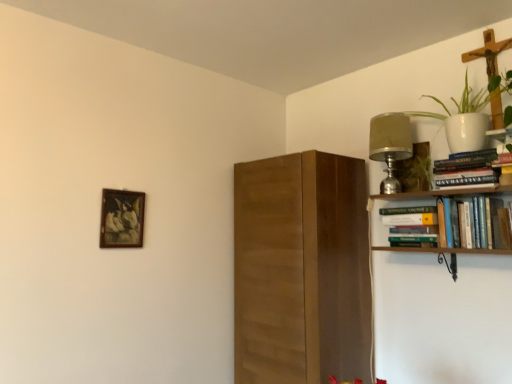
Question: Can you confirm if hardcover books at upper right, marked as the first book in a bottom-to-top arrangement, is thinner than wooden picture frame at upper left?

Choices:
 (A) no
 (B) yes

Answer: (A)

Question: Is hardcover books at upper right, marked as the first book in a bottom-to-top arrangement, at the left side of wooden picture frame at upper left?

Choices:
 (A) yes
 (B) no

Answer: (B)

Question: From the image's perspective, is hardcover books at upper right, which is the 3th book from top to bottom, under wooden picture frame at upper left?

Choices:
 (A) no
 (B) yes

Answer: (B)

Question: Is hardcover books at upper right, marked as the first book in a bottom-to-top arrangement, turned away from wooden picture frame at upper left?

Choices:
 (A) yes
 (B) no

Answer: (B)

Question: From a real-world perspective, is hardcover books at upper right, which is the 3th book from top to bottom, positioned over wooden picture frame at upper left based on gravity?

Choices:
 (A) yes
 (B) no

Answer: (B)

Question: Is wooden picture frame at upper left completely or partially inside hardcover books at upper right, which is the 3th book from top to bottom?

Choices:
 (A) no
 (B) yes

Answer: (A)

Question: Is matte silver lamp at upper right oriented away from wooden picture frame at upper left?

Choices:
 (A) no
 (B) yes

Answer: (A)

Question: Does matte silver lamp at upper right come behind wooden picture frame at upper left?

Choices:
 (A) yes
 (B) no

Answer: (A)

Question: Can you confirm if matte silver lamp at upper right is thinner than wooden picture frame at upper left?

Choices:
 (A) yes
 (B) no

Answer: (B)

Question: Does matte silver lamp at upper right have a greater height compared to wooden picture frame at upper left?

Choices:
 (A) yes
 (B) no

Answer: (A)

Question: Can you confirm if matte silver lamp at upper right is wider than wooden picture frame at upper left?

Choices:
 (A) yes
 (B) no

Answer: (A)

Question: Can you confirm if matte silver lamp at upper right is positioned to the right of wooden picture frame at upper left?

Choices:
 (A) no
 (B) yes

Answer: (B)

Question: From the image's perspective, would you say hardcover book at upper right, the second book positioned from the bottom, is shown under hardcover books at upper right, which is the 3th book from top to bottom?

Choices:
 (A) yes
 (B) no

Answer: (B)